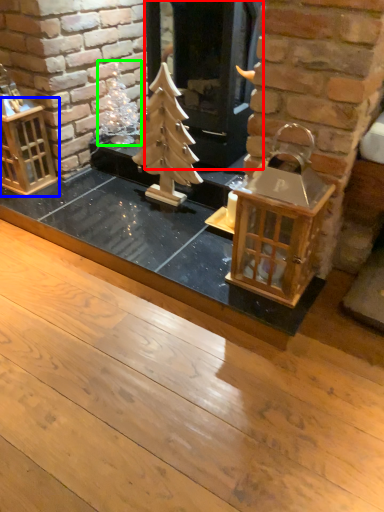
Question: Which object is the farthest from fireplace (highlighted by a red box)? Choose among these: cage (highlighted by a blue box) or christmas decoration (highlighted by a green box).

Choices:
 (A) cage
 (B) christmas decoration

Answer: (A)